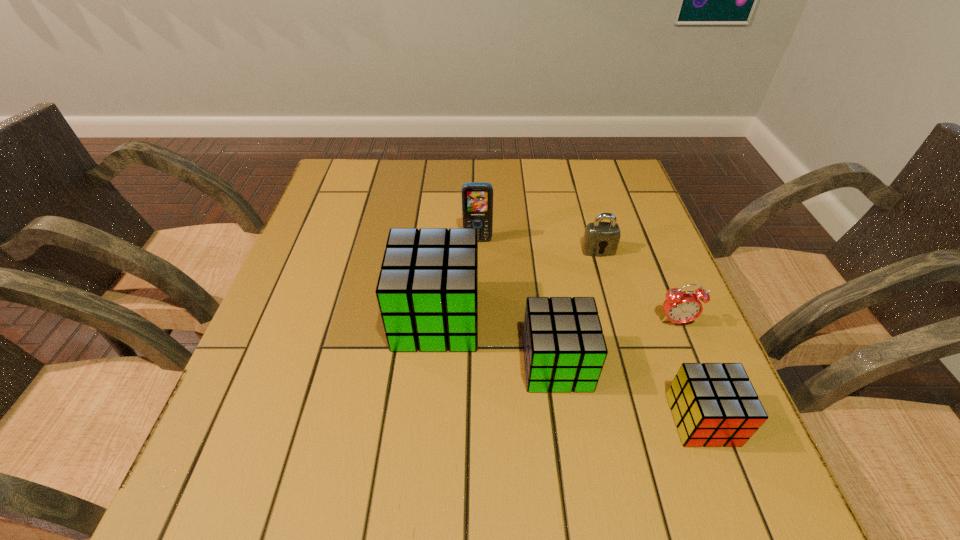
Locate an element on the screen. empty location between the fourth object from right to left and the alarm clock is located at coordinates (616, 343).

What are the coordinates of `empty space between the second farthest object and the alarm clock` in the screenshot? It's located at (637, 286).

Image resolution: width=960 pixels, height=540 pixels. Identify the location of free space that is in between the second tallest cube and the alarm clock. (616, 343).

Find the location of `the fifth closest object to the second cube from left to right`. the fifth closest object to the second cube from left to right is located at coordinates (477, 198).

This screenshot has height=540, width=960. I want to click on object identified as the closest to the fifth nearest object, so click(x=680, y=307).

Locate an element on the screen. The height and width of the screenshot is (540, 960). cube identified as the second closest to the leftmost cube is located at coordinates (713, 404).

The image size is (960, 540). Find the location of `cube that is the second closest one to the padlock`. cube that is the second closest one to the padlock is located at coordinates (427, 291).

Identify the location of free location that satisfies the following two spatial constraints: 1. on the front side of the rightmost cube; 2. on the right side of the leftmost cube. (427, 420).

This screenshot has width=960, height=540. Find the location of `free location that satisfies the following two spatial constraints: 1. on the screen of the second cube from right to left; 2. on the right side of the farthest object`. free location that satisfies the following two spatial constraints: 1. on the screen of the second cube from right to left; 2. on the right side of the farthest object is located at coordinates (477, 364).